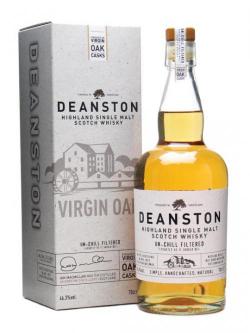
Identify the location of cork. The image size is (250, 333). (189, 36).